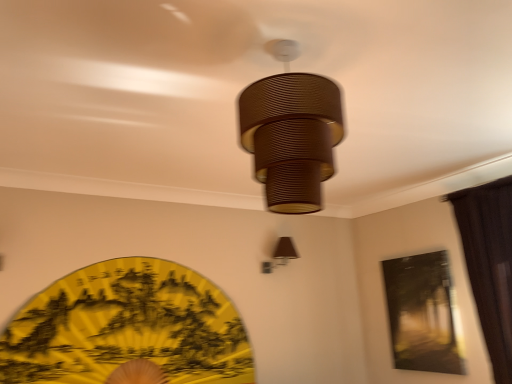
Question: Is matte black painting at upper right not inside brown fabric curtain at right?

Choices:
 (A) no
 (B) yes

Answer: (B)

Question: Is matte black painting at upper right facing away from brown fabric curtain at right?

Choices:
 (A) yes
 (B) no

Answer: (B)

Question: Are matte black painting at upper right and brown fabric curtain at right making contact?

Choices:
 (A) no
 (B) yes

Answer: (A)

Question: Is matte black painting at upper right closer to camera compared to brown fabric curtain at right?

Choices:
 (A) yes
 (B) no

Answer: (B)

Question: Could you tell me if matte black painting at upper right is facing brown fabric curtain at right?

Choices:
 (A) yes
 (B) no

Answer: (B)

Question: Can you confirm if matte black painting at upper right is smaller than brown fabric curtain at right?

Choices:
 (A) no
 (B) yes

Answer: (B)

Question: Can you confirm if brown fabric curtain at right is bigger than brown fabric lampshade at upper right, the 1th lamp positioned from the back?

Choices:
 (A) yes
 (B) no

Answer: (A)

Question: Considering the relative sizes of brown fabric curtain at right and brown fabric lampshade at upper right, which ranks as the second lamp in top-to-bottom order, in the image provided, is brown fabric curtain at right shorter than brown fabric lampshade at upper right, which ranks as the second lamp in top-to-bottom order,?

Choices:
 (A) no
 (B) yes

Answer: (A)

Question: Does brown fabric curtain at right appear on the left side of brown fabric lampshade at upper right, arranged as the second lamp when viewed from the front?

Choices:
 (A) yes
 (B) no

Answer: (B)

Question: From a real-world perspective, is brown fabric curtain at right positioned under brown fabric lampshade at upper right, arranged as the second lamp when viewed from the front, based on gravity?

Choices:
 (A) no
 (B) yes

Answer: (B)

Question: Is brown fabric curtain at right positioned behind brown fabric lampshade at upper right, which ranks as the second lamp in top-to-bottom order?

Choices:
 (A) no
 (B) yes

Answer: (A)

Question: Is brown fabric lampshade at upper right, the 1th lamp positioned from the back, located within brown fabric curtain at right?

Choices:
 (A) no
 (B) yes

Answer: (A)

Question: Considering the relative sizes of brown fabric curtain at right and brown ribbed lampshade at center, the 1th lamp when ordered from front to back, in the image provided, is brown fabric curtain at right taller than brown ribbed lampshade at center, the 1th lamp when ordered from front to back,?

Choices:
 (A) no
 (B) yes

Answer: (B)